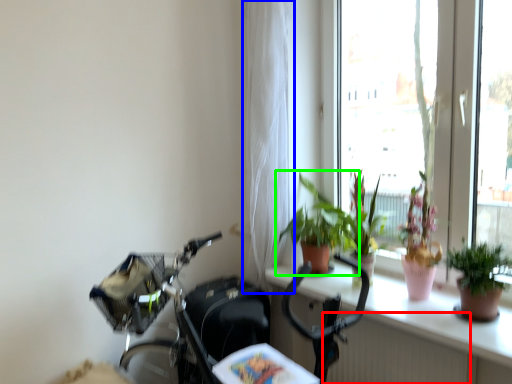
Question: Considering the real-world distances, which object is farthest from radiator (highlighted by a red box)? curtain (highlighted by a blue box) or houseplant (highlighted by a green box)?

Choices:
 (A) curtain
 (B) houseplant

Answer: (A)